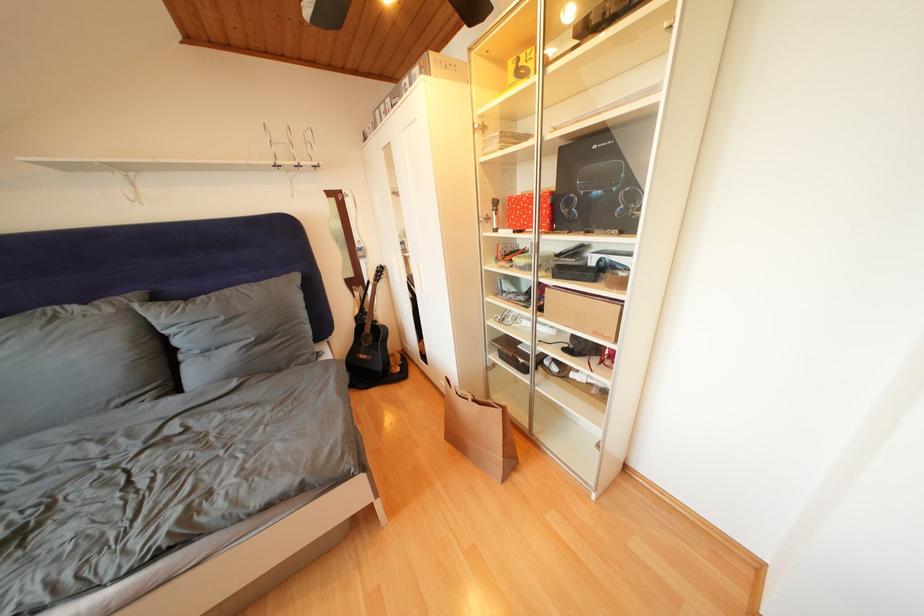
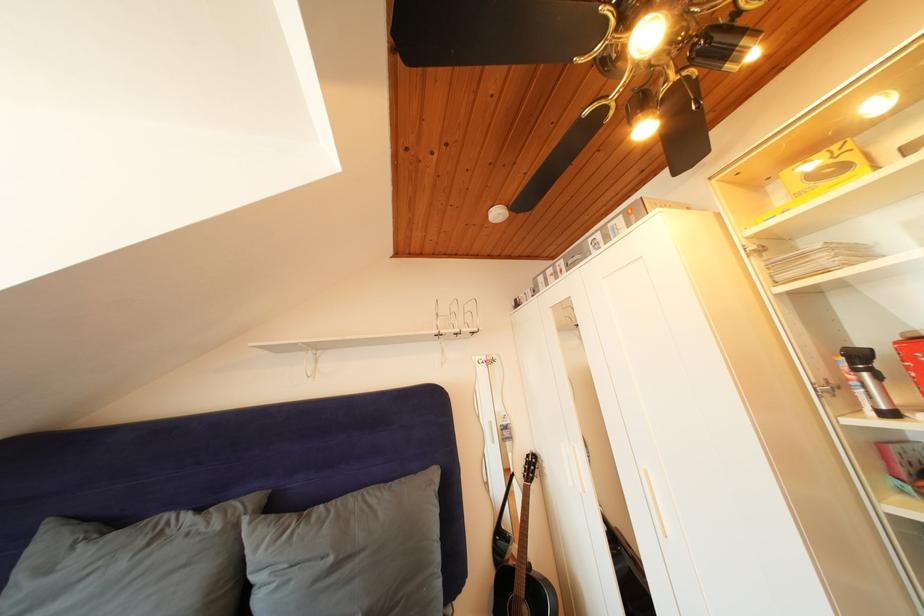
Find the pixel in the second image that matches (231,323) in the first image.

(338, 565)